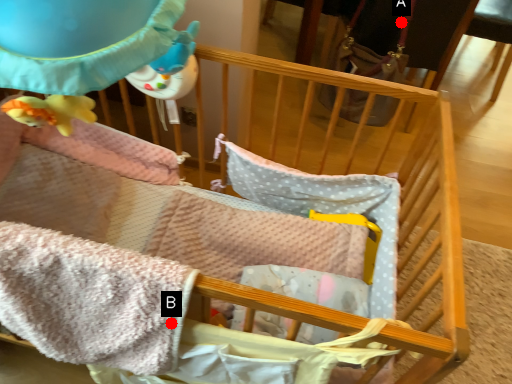
Question: Two points are circled on the image, labeled by A and B beside each circle. Which point is closer to the camera taking this photo?

Choices:
 (A) A is closer
 (B) B is closer

Answer: (B)